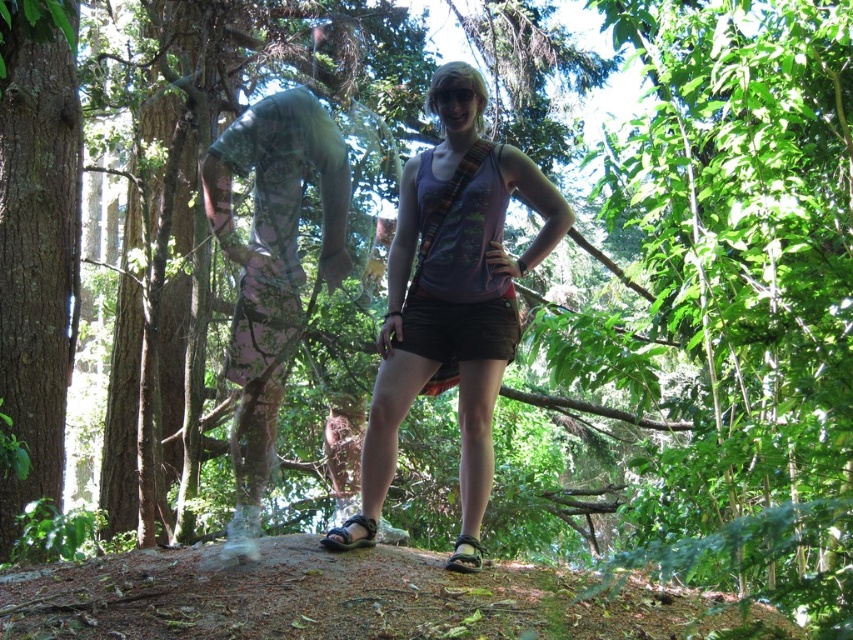
Who is more distant from viewer, (433, 244) or (16, 173)?

Point (16, 173)

Is point (412, 340) more distant than point (16, 214)?

No, (412, 340) is in front of (16, 214).

Which is in front, point (440, 348) or point (49, 80)?

Positioned in front is point (440, 348).

The image size is (853, 640). Find the location of `matte purple tank top at center`. matte purple tank top at center is located at coordinates (451, 300).